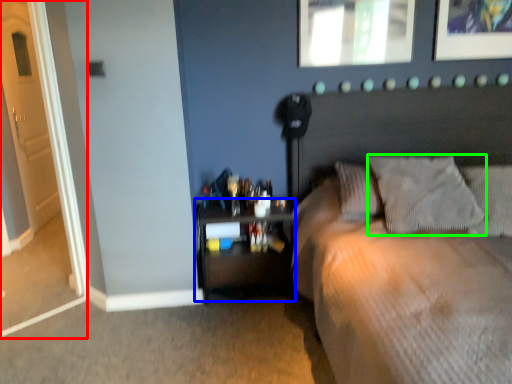
Question: Which object is the closest to the door (highlighted by a red box)? Choose among these: nightstand (highlighted by a blue box) or pillow (highlighted by a green box).

Choices:
 (A) nightstand
 (B) pillow

Answer: (A)